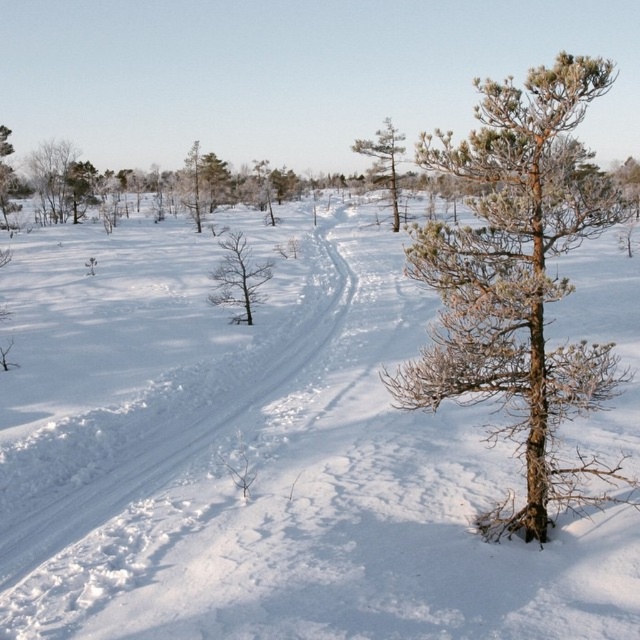
Is point (600, 93) closer to viewer compared to point (250, 268)?

Yes, point (600, 93) is in front of point (250, 268).

Who is positioned more to the right, snow-covered pine tree at right or brown/dry wood tree at center?

snow-covered pine tree at right is more to the right.

Describe the element at coordinates (516, 276) in the screenshot. The width and height of the screenshot is (640, 640). I see `snow-covered pine tree at right` at that location.

Find the location of a particular element. snow-covered pine tree at right is located at coordinates (516, 276).

Does brown/dry wood tree at center have a greater width compared to green needle-like tree at center?

In fact, brown/dry wood tree at center might be narrower than green needle-like tree at center.

What do you see at coordinates (237, 276) in the screenshot? I see `brown/dry wood tree at center` at bounding box center [237, 276].

This screenshot has width=640, height=640. What are the coordinates of `brown/dry wood tree at center` in the screenshot? It's located at (237, 276).

Is snow-covered pine tree at right smaller than green needle-like tree at center?

No, snow-covered pine tree at right is not smaller than green needle-like tree at center.

Is point (516, 120) farther from viewer compared to point (353, 148)?

No, (516, 120) is in front of (353, 148).

At what (x,y) coordinates should I click in order to perform the action: click on snow-covered pine tree at right. Please return your answer as a coordinate pair (x, y). This screenshot has height=640, width=640. Looking at the image, I should click on tap(516, 276).